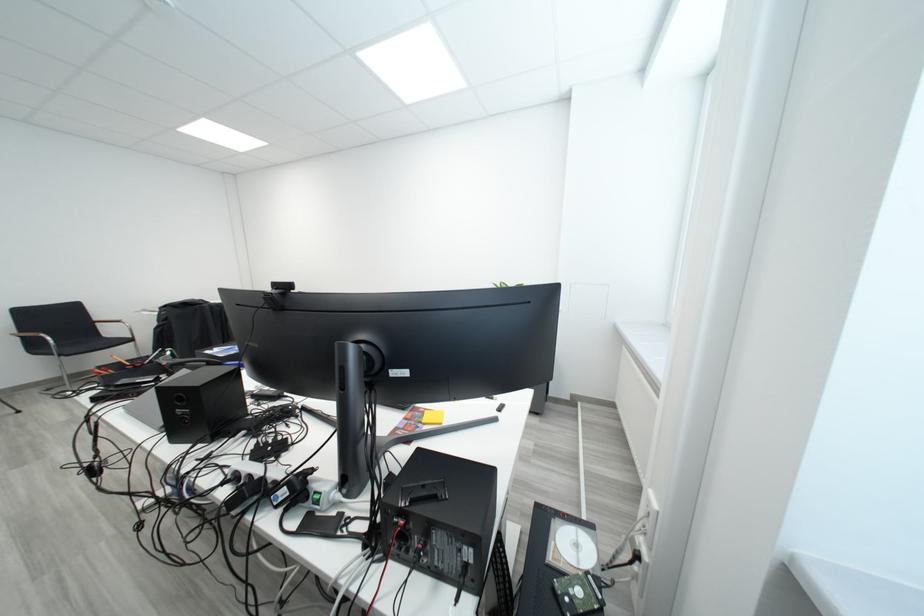
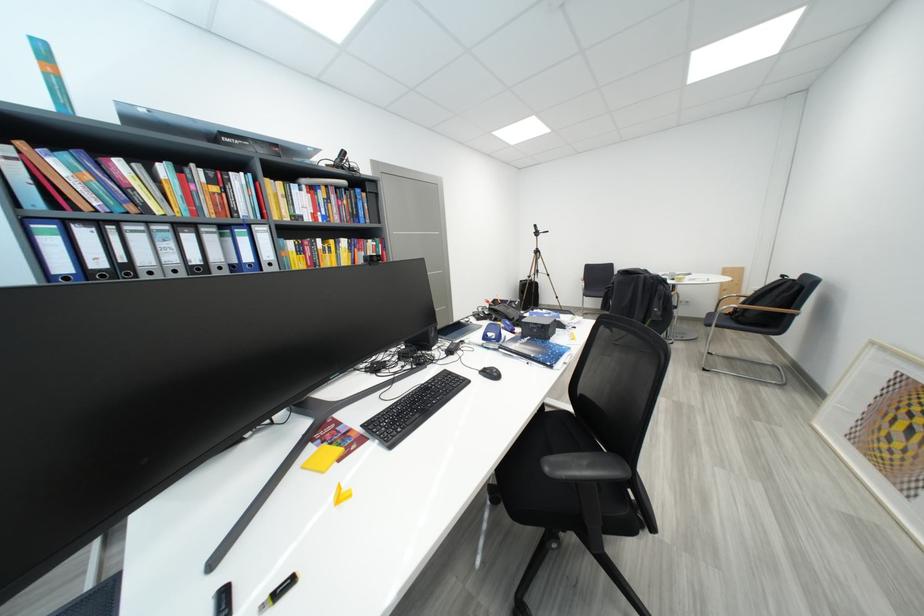
In the second image, find the point that corresponds to (411,431) in the first image.

(343, 432)